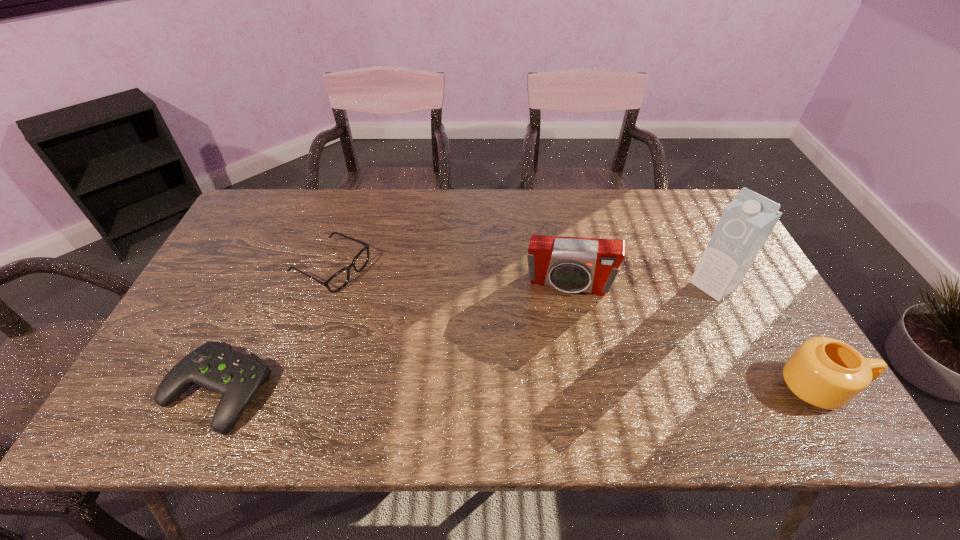
You are a GUI agent. You are given a task and a screenshot of the screen. Output one action in this format:
    pyautogui.click(x=<x>, y=<y>)
    Task: Click on the carton situated at the right edge
    The width and height of the screenshot is (960, 540).
    Given the screenshot: What is the action you would take?
    pyautogui.click(x=746, y=223)

This screenshot has width=960, height=540. Find the location of `object that is at the near left corner`. object that is at the near left corner is located at coordinates (215, 366).

In order to click on object at the near right corner in this screenshot , I will do `click(825, 372)`.

The height and width of the screenshot is (540, 960). In order to click on free space at the far edge of the desktop in this screenshot , I will do `click(586, 208)`.

Identify the location of vacant area at the near edge. (332, 365).

You are a GUI agent. You are given a task and a screenshot of the screen. Output one action in this format:
    pyautogui.click(x=<x>, y=<y>)
    Task: Click on the free space at the far right corner
    The width and height of the screenshot is (960, 540).
    Given the screenshot: What is the action you would take?
    pyautogui.click(x=696, y=198)

Locate an element on the screen. Image resolution: width=960 pixels, height=540 pixels. vacant region at the near right corner of the desktop is located at coordinates (759, 384).

You are a GUI agent. You are given a task and a screenshot of the screen. Output one action in this format:
    pyautogui.click(x=<x>, y=<y>)
    Task: Click on the vacant area that lies between the control and the camera
    This screenshot has height=540, width=960.
    Given the screenshot: What is the action you would take?
    393,337

Find the location of a particular element. The height and width of the screenshot is (540, 960). blank region between the camera and the mug is located at coordinates (694, 336).

Where is `vacant region between the third shortest object and the spectacles`? Image resolution: width=960 pixels, height=540 pixels. vacant region between the third shortest object and the spectacles is located at coordinates (576, 328).